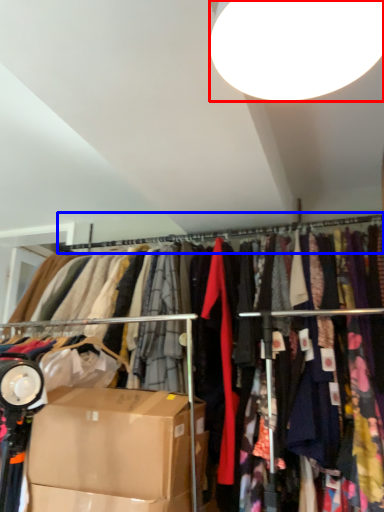
Question: Among these objects, which one is nearest to the camera, lamp (highlighted by a red box) or clothesline (highlighted by a blue box)?

Choices:
 (A) lamp
 (B) clothesline

Answer: (A)